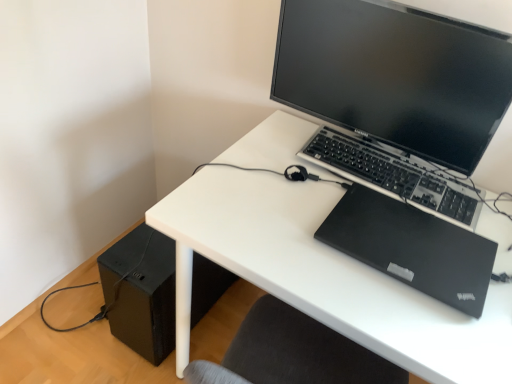
At what (x,y) coordinates should I click in order to perform the action: click on vacant space situated on the left part of black matte laptop at upper right. Please return your answer as a coordinate pair (x, y). Image resolution: width=512 pixels, height=384 pixels. Looking at the image, I should click on (285, 221).